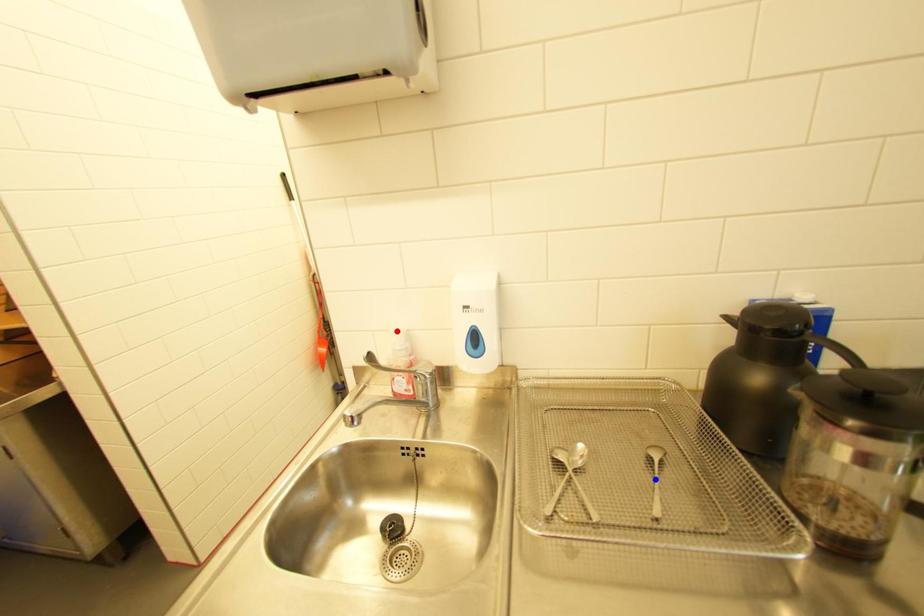
Question: Two points are marked on the image. Which point is closer to the camera?

Choices:
 (A) Blue point is closer.
 (B) Red point is closer.

Answer: (A)